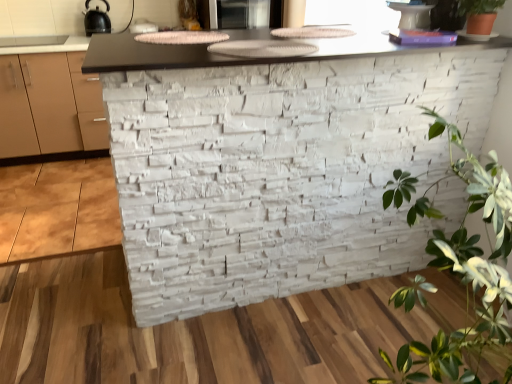
Question: Is black matte kettle at upper left, the 1th appliance viewed from the left, at the right side of white stone wall at center?

Choices:
 (A) yes
 (B) no

Answer: (B)

Question: From a real-world perspective, is black matte kettle at upper left, the second appliance from the right, physically above white stone wall at center?

Choices:
 (A) no
 (B) yes

Answer: (B)

Question: Does black matte kettle at upper left, the second appliance from the right, lie behind white stone wall at center?

Choices:
 (A) no
 (B) yes

Answer: (B)

Question: Does black matte kettle at upper left, the 1th appliance viewed from the left, contain white stone wall at center?

Choices:
 (A) yes
 (B) no

Answer: (B)

Question: Is black matte kettle at upper left, the second appliance from the right, outside of white stone wall at center?

Choices:
 (A) yes
 (B) no

Answer: (A)

Question: Considering the positions of white stone wall at center and black matte kettle at upper left, the second appliance from the right, in the image, is white stone wall at center bigger or smaller than black matte kettle at upper left, the second appliance from the right,?

Choices:
 (A) small
 (B) big

Answer: (B)

Question: Is white stone wall at center taller or shorter than black matte kettle at upper left, the 1th appliance viewed from the left?

Choices:
 (A) short
 (B) tall

Answer: (B)

Question: From a real-world perspective, is white stone wall at center above or below black matte kettle at upper left, the 1th appliance viewed from the left?

Choices:
 (A) above
 (B) below

Answer: (B)

Question: Is white stone wall at center to the left or to the right of black matte kettle at upper left, the 1th appliance viewed from the left, in the image?

Choices:
 (A) left
 (B) right

Answer: (B)

Question: Considering the positions of matte black microwave at upper center, the 2th appliance when ordered from left to right, and white stone wall at center in the image, is matte black microwave at upper center, the 2th appliance when ordered from left to right, wider or thinner than white stone wall at center?

Choices:
 (A) thin
 (B) wide

Answer: (A)

Question: Considering the positions of point (244, 18) and point (128, 208), is point (244, 18) closer or farther from the camera than point (128, 208)?

Choices:
 (A) closer
 (B) farther

Answer: (B)

Question: Choose the correct answer: Is matte black microwave at upper center, the 1th appliance positioned from the right, inside white stone wall at center or outside it?

Choices:
 (A) outside
 (B) inside

Answer: (A)

Question: Would you say matte black microwave at upper center, the 2th appliance when ordered from left to right, is to the left or to the right of white stone wall at center in the picture?

Choices:
 (A) right
 (B) left

Answer: (B)

Question: Is black matte kettle at upper left, the 1th appliance viewed from the left, wider or thinner than green leafy plant at right, which is counted as the 1th houseplant, starting from the bottom?

Choices:
 (A) wide
 (B) thin

Answer: (B)

Question: Considering the relative positions of black matte kettle at upper left, the 1th appliance viewed from the left, and green leafy plant at right, which ranks as the second houseplant in top-to-bottom order, in the image provided, is black matte kettle at upper left, the 1th appliance viewed from the left, to the left or to the right of green leafy plant at right, which ranks as the second houseplant in top-to-bottom order,?

Choices:
 (A) right
 (B) left

Answer: (B)